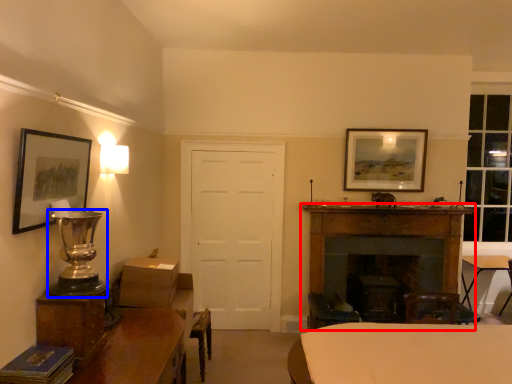
Question: Which point is further to the camera, fireplace (highlighted by a red box) or table lamp (highlighted by a blue box)?

Choices:
 (A) fireplace
 (B) table lamp

Answer: (A)